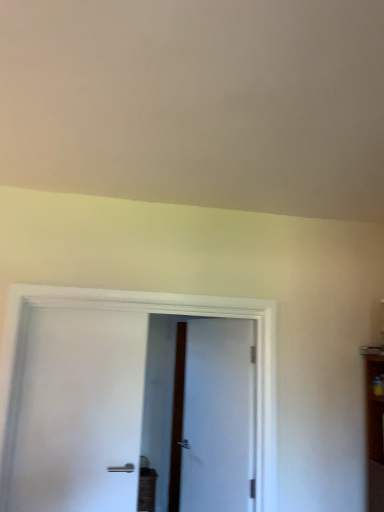
Find the location of a particular element. Image resolution: width=384 pixels, height=512 pixels. white textured door at center, the first door when ordered from right to left is located at coordinates (214, 417).

Describe the element at coordinates (214, 417) in the screenshot. I see `white textured door at center, which is the 1th door in back-to-front order` at that location.

What is the approximate height of white textured door at center, the first door when ordered from right to left?

white textured door at center, the first door when ordered from right to left, is 1.34 meters tall.

In order to click on white matte door at left, acting as the 1th door starting from the front in this screenshot , I will do `click(80, 411)`.

What do you see at coordinates (80, 411) in the screenshot? I see `white matte door at left, which is the 1th door in left-to-right order` at bounding box center [80, 411].

Where is `white textured door at center, the first door when ordered from right to left`? Image resolution: width=384 pixels, height=512 pixels. white textured door at center, the first door when ordered from right to left is located at coordinates (214, 417).

Between white matte door at left, marked as the second door in a back-to-front arrangement, and white textured door at center, which is the 1th door in back-to-front order, which one appears on the left side from the viewer's perspective?

white matte door at left, marked as the second door in a back-to-front arrangement, is more to the left.

Considering their positions, is white matte door at left, which is counted as the 2th door, starting from the right, located in front of or behind white textured door at center, which is the 1th door in back-to-front order?

white matte door at left, which is counted as the 2th door, starting from the right, is in front of white textured door at center, which is the 1th door in back-to-front order.

Is point (30, 503) positioned before point (216, 414)?

Yes, it is in front of point (216, 414).

From the image's perspective, between white matte door at left, marked as the second door in a back-to-front arrangement, and white textured door at center, the second door when ordered from left to right, which one is located above?

From the image's view, white matte door at left, marked as the second door in a back-to-front arrangement, is above.

From a real-world perspective, which is physically above, white matte door at left, acting as the 1th door starting from the front, or white textured door at center, the second door when ordered from left to right?

white matte door at left, acting as the 1th door starting from the front.

Which of these two, white matte door at left, marked as the second door in a back-to-front arrangement, or white textured door at center, which is the 2th door in front-to-back order, is thinner?

white matte door at left, marked as the second door in a back-to-front arrangement, is thinner.

In the scene shown: Does white matte door at left, marked as the second door in a back-to-front arrangement, have a lesser height compared to white textured door at center, which is the 2th door in front-to-back order?

Correct, white matte door at left, marked as the second door in a back-to-front arrangement, is not as tall as white textured door at center, which is the 2th door in front-to-back order.

Which of these two, white matte door at left, marked as the second door in a back-to-front arrangement, or white textured door at center, the first door when ordered from right to left, is bigger?

Bigger between the two is white textured door at center, the first door when ordered from right to left.

Would you say white matte door at left, acting as the 1th door starting from the front, is outside white textured door at center, the first door when ordered from right to left?

Absolutely, white matte door at left, acting as the 1th door starting from the front, is external to white textured door at center, the first door when ordered from right to left.

Is white matte door at left, which is the 1th door in left-to-right order, looking in the opposite direction of white textured door at center, which is the 1th door in back-to-front order?

No, white textured door at center, which is the 1th door in back-to-front order, is not at the back of white matte door at left, which is the 1th door in left-to-right order.

Can you tell me how much white matte door at left, which is the 1th door in left-to-right order, and white textured door at center, the second door when ordered from left to right, differ in facing direction?

67.9 degrees.

Find the location of `door that is above the white textured door at center, which is the 2th door in front-to-back order (from a real-world perspective)`. door that is above the white textured door at center, which is the 2th door in front-to-back order (from a real-world perspective) is located at coordinates (80, 411).

Is white textured door at center, the first door when ordered from right to left, to the right of white matte door at left, which is counted as the 2th door, starting from the right, from the viewer's perspective?

Indeed, white textured door at center, the first door when ordered from right to left, is positioned on the right side of white matte door at left, which is counted as the 2th door, starting from the right.

Which is in front, white textured door at center, which is the 2th door in front-to-back order, or white matte door at left, which is counted as the 2th door, starting from the right?

white matte door at left, which is counted as the 2th door, starting from the right, is closer to the camera.

Does point (181, 351) come behind point (116, 503)?

Yes, it is.

From the image's perspective, between white textured door at center, the first door when ordered from right to left, and white matte door at left, which is counted as the 2th door, starting from the right, which one is located above?

white matte door at left, which is counted as the 2th door, starting from the right, is shown above in the image.

From a real-world perspective, which object stands above the other?

From a 3D spatial view, white matte door at left, marked as the second door in a back-to-front arrangement, is above.

Can you confirm if white textured door at center, the first door when ordered from right to left, is thinner than white matte door at left, which is counted as the 2th door, starting from the right?

Incorrect, the width of white textured door at center, the first door when ordered from right to left, is not less than that of white matte door at left, which is counted as the 2th door, starting from the right.

Between white textured door at center, the first door when ordered from right to left, and white matte door at left, which is the 1th door in left-to-right order, which one has more height?

white textured door at center, the first door when ordered from right to left, is taller.

Which of these two, white textured door at center, the first door when ordered from right to left, or white matte door at left, marked as the second door in a back-to-front arrangement, is smaller?

white matte door at left, marked as the second door in a back-to-front arrangement.

Is white textured door at center, the second door when ordered from left to right, surrounding white matte door at left, which is the 1th door in left-to-right order?

No, white matte door at left, which is the 1th door in left-to-right order, is not a part of white textured door at center, the second door when ordered from left to right.

Is white textured door at center, the first door when ordered from right to left, far away from white matte door at left, which is counted as the 2th door, starting from the right?

white textured door at center, the first door when ordered from right to left, is near white matte door at left, which is counted as the 2th door, starting from the right, not far away.

Is white textured door at center, the second door when ordered from left to right, oriented away from white matte door at left, acting as the 1th door starting from the front?

Yes, white textured door at center, the second door when ordered from left to right,'s orientation is away from white matte door at left, acting as the 1th door starting from the front.

What's the angular difference between white textured door at center, the second door when ordered from left to right, and white matte door at left, which is counted as the 2th door, starting from the right,'s facing directions?

67.9 degrees.

This screenshot has height=512, width=384. Identify the location of door below the white matte door at left, which is the 1th door in left-to-right order (from the image's perspective). (214, 417).

I want to click on door below the white matte door at left, which is counted as the 2th door, starting from the right (from the image's perspective), so (214, 417).

The width and height of the screenshot is (384, 512). I want to click on door in front of the white textured door at center, the second door when ordered from left to right, so click(80, 411).